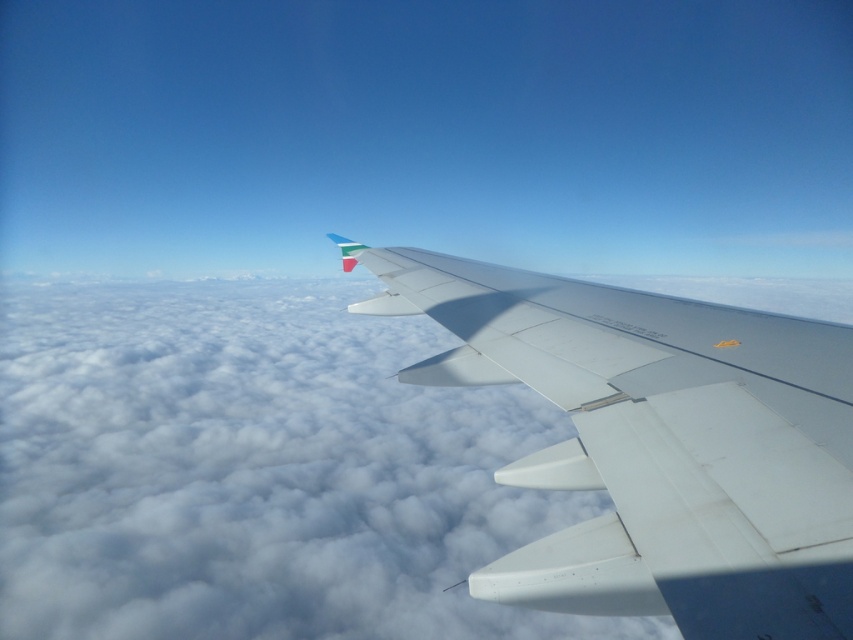
You are a passenger sitting in an airplane seat. You look out the window and see the white fluffy cloud at upper center and the white matte wing at upper right. Which object appears taller from your viewpoint?

The white fluffy cloud at upper center appears taller than the white matte wing at upper right because it has a greater height compared to the white matte wing at upper right according to the description.

You are a pilot sitting in the cockpit of an airplane. You notice a white fluffy cloud at upper center through the window. If you want to take a photo of it with your camera, which is 8.91 meters away from the cloud, is the distance within the camera lens range? Assume the camera can focus up to 10 meters.

The white fluffy cloud at upper center and the camera are 8.91 meters apart, which is within the camera lens range of up to 10 meters. Therefore, the camera can focus on the white fluffy cloud at upper center.